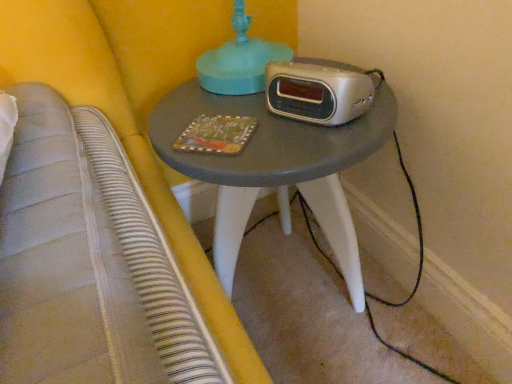
Question: In terms of width, does silver metallic alarm clock at center look wider or thinner when compared to wooden painted book at center?

Choices:
 (A) wide
 (B) thin

Answer: (B)

Question: From their relative heights in the image, would you say silver metallic alarm clock at center is taller or shorter than wooden painted book at center?

Choices:
 (A) tall
 (B) short

Answer: (A)

Question: Which of these objects is positioned closest to the matte gray table at center?

Choices:
 (A) wooden painted book at center
 (B) silver metallic alarm clock at center

Answer: (B)

Question: Which is farther from the wooden painted book at center?

Choices:
 (A) matte gray table at center
 (B) silver metallic alarm clock at center

Answer: (A)